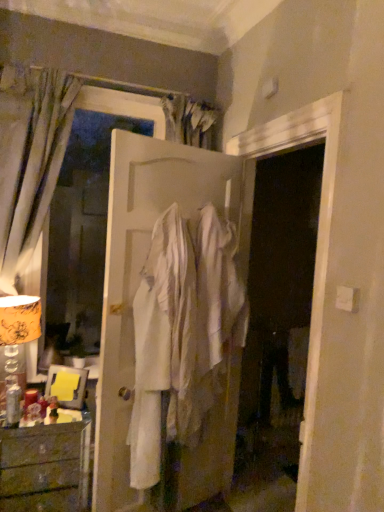
Question: Considering the positions of wooden chest of drawers at lower left and gold-patterned fabric lampshade at left in the image, is wooden chest of drawers at lower left taller or shorter than gold-patterned fabric lampshade at left?

Choices:
 (A) short
 (B) tall

Answer: (A)

Question: Is wooden chest of drawers at lower left to the left or to the right of gold-patterned fabric lampshade at left in the image?

Choices:
 (A) right
 (B) left

Answer: (A)

Question: Which object is the closest to the white matte door at center?

Choices:
 (A) silky gray curtain at left
 (B) gold-patterned fabric lampshade at left
 (C) wooden chest of drawers at lower left

Answer: (A)

Question: Which object is positioned closest to the white matte door at center?

Choices:
 (A) wooden chest of drawers at lower left
 (B) silky gray curtain at left
 (C) gold-patterned fabric lampshade at left

Answer: (B)